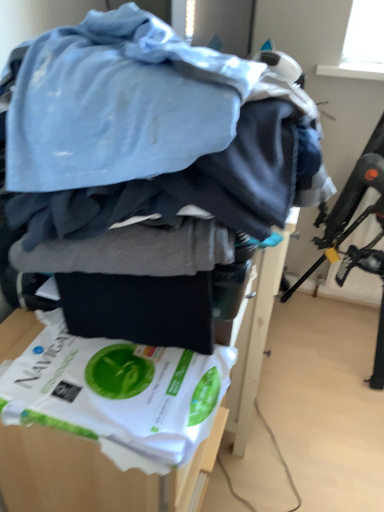
Where is `vacant area on top of white paper at lower left (from a real-world perspective)`? This screenshot has width=384, height=512. vacant area on top of white paper at lower left (from a real-world perspective) is located at coordinates (116, 375).